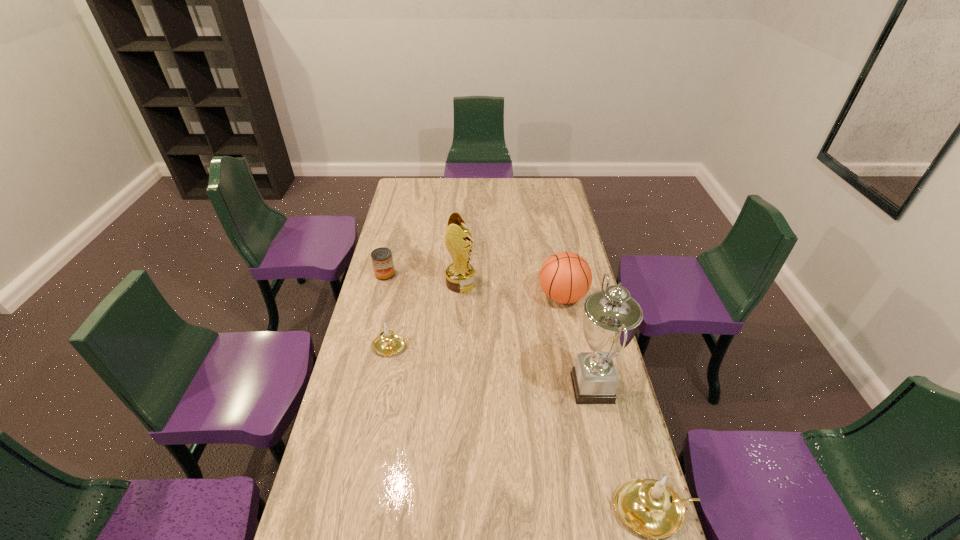
This screenshot has width=960, height=540. I want to click on free space at the right edge of the desktop, so click(x=539, y=218).

Locate an element on the screen. vacant area that lies between the trophy cup and the can is located at coordinates (489, 330).

Locate an element on the screen. The width and height of the screenshot is (960, 540). vacant space that is in between the third object from left to right and the can is located at coordinates (422, 279).

Find the location of `free space between the tallest object and the fourth object from right to left`. free space between the tallest object and the fourth object from right to left is located at coordinates (526, 335).

This screenshot has width=960, height=540. I want to click on vacant point located between the trophy cup and the can, so click(489, 330).

Identify the location of free space between the fifth shortest object and the shorter candle holder. The image size is (960, 540). (426, 315).

Locate an element on the screen. unoccupied area between the third object from left to right and the can is located at coordinates (422, 279).

This screenshot has width=960, height=540. I want to click on empty location between the farther candle holder and the tallest object, so click(492, 367).

What are the coordinates of `vacant space that's between the basketball and the farther candle holder` in the screenshot? It's located at (477, 321).

Where is `object that ranks as the closest to the third object from left to right`? object that ranks as the closest to the third object from left to right is located at coordinates (382, 260).